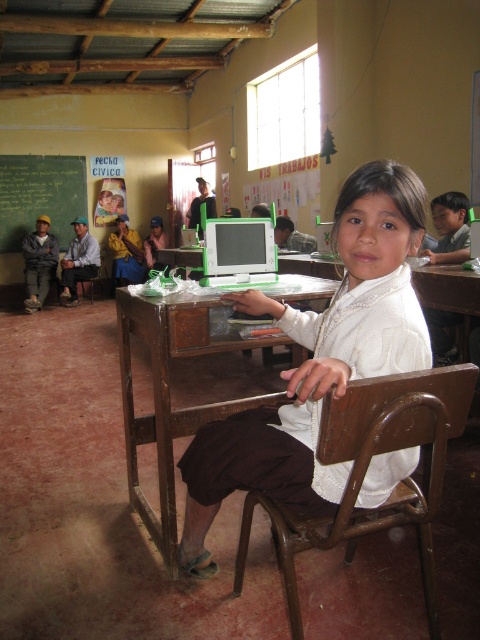
Between green chalkboard at upper left and matte yellow shirt at center, which one appears on the right side from the viewer's perspective?

From the viewer's perspective, matte yellow shirt at center appears more on the right side.

Is green chalkboard at upper left closer to the viewer compared to matte yellow shirt at center?

Yes, it is.

Which is behind, point (8, 240) or point (115, 237)?

Positioned behind is point (115, 237).

Find the location of a particular element. This screenshot has width=480, height=640. green chalkboard at upper left is located at coordinates (39, 195).

Is matte white laptop at center closer to the viewer compared to matte yellow shirt at center?

Yes.

Between point (233, 243) and point (121, 257), which one is positioned behind?

Point (121, 257)

This screenshot has width=480, height=640. What are the coordinates of `matte white laptop at center` in the screenshot? It's located at (239, 252).

Is brown wooden chair at center shorter than matte gray shirt at left?

Yes.

Between brown wooden chair at center and matte gray shirt at left, which one has more height?

matte gray shirt at left

Who is more distant from viewer, (386, 390) or (79, 253)?

Positioned behind is point (79, 253).

At what (x,y) coordinates should I click in order to perform the action: click on brown wooden chair at center. Please return your answer as a coordinate pair (x, y). The image size is (480, 640). Looking at the image, I should click on (365, 474).